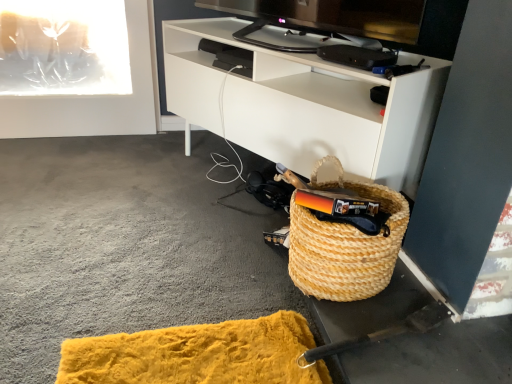
Question: Looking at their shapes, would you say natural woven basket at lower right is wider or thinner than white matte cabinet at lower right?

Choices:
 (A) thin
 (B) wide

Answer: (A)

Question: Is point (314, 256) closer or farther from the camera than point (420, 150)?

Choices:
 (A) closer
 (B) farther

Answer: (A)

Question: Considering the positions of natural woven basket at lower right and white matte cabinet at lower right in the image, is natural woven basket at lower right taller or shorter than white matte cabinet at lower right?

Choices:
 (A) tall
 (B) short

Answer: (B)

Question: Is point (394, 152) positioned closer to the camera than point (342, 281)?

Choices:
 (A) closer
 (B) farther

Answer: (B)

Question: Is white matte cabinet at lower right to the left or to the right of natural woven basket at lower right in the image?

Choices:
 (A) right
 (B) left

Answer: (B)

Question: From a real-world perspective, is white matte cabinet at lower right positioned above or below natural woven basket at lower right?

Choices:
 (A) below
 (B) above

Answer: (B)

Question: Is white matte cabinet at lower right bigger or smaller than natural woven basket at lower right?

Choices:
 (A) big
 (B) small

Answer: (A)